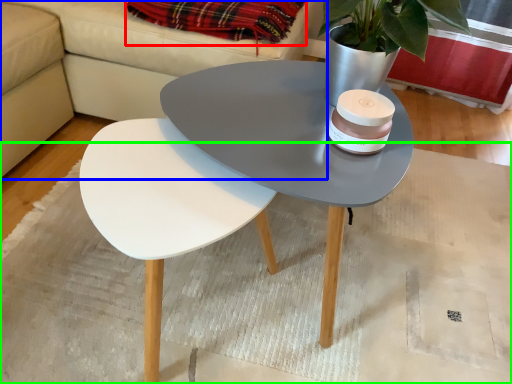
Question: Based on their relative distances, which object is nearer to blanket (highlighted by a red box)? Choose from couch (highlighted by a blue box) and mat (highlighted by a green box).

Choices:
 (A) couch
 (B) mat

Answer: (A)